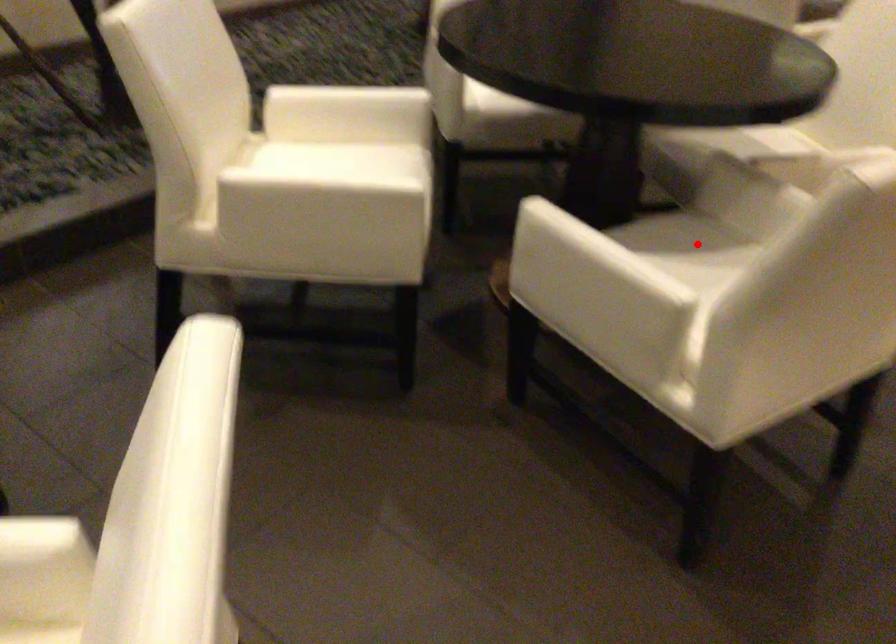
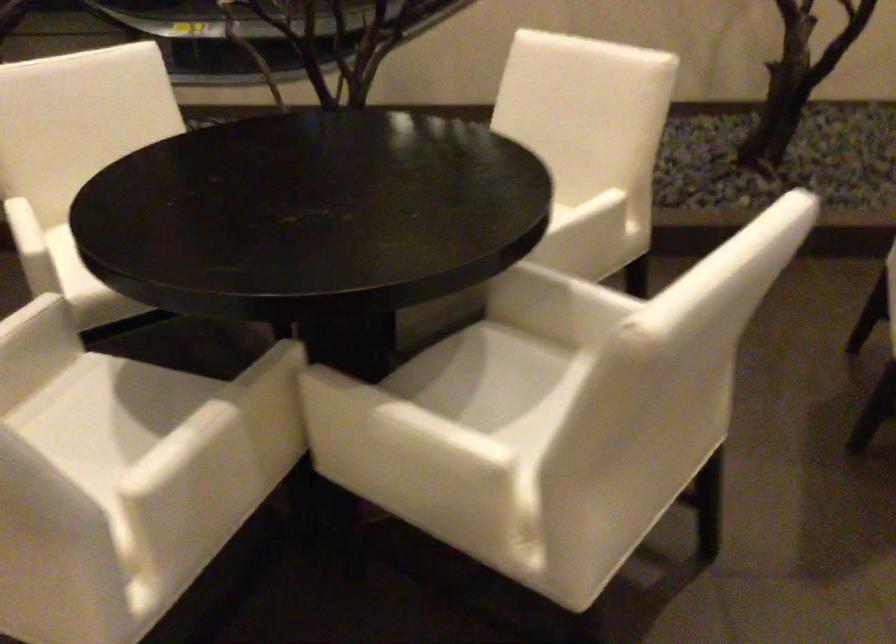
Where in the second image is the point corresponding to the highlighted location from the first image?

(156, 420)